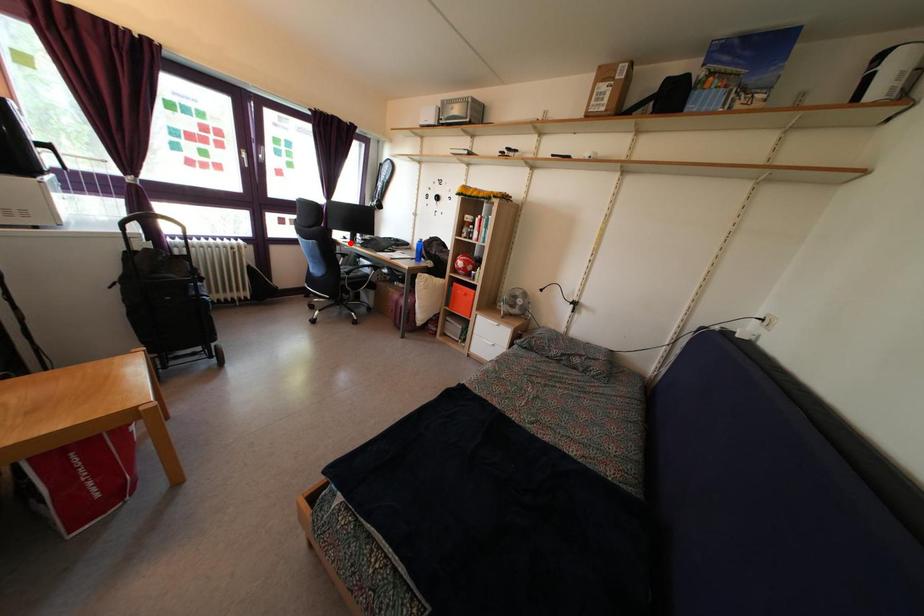
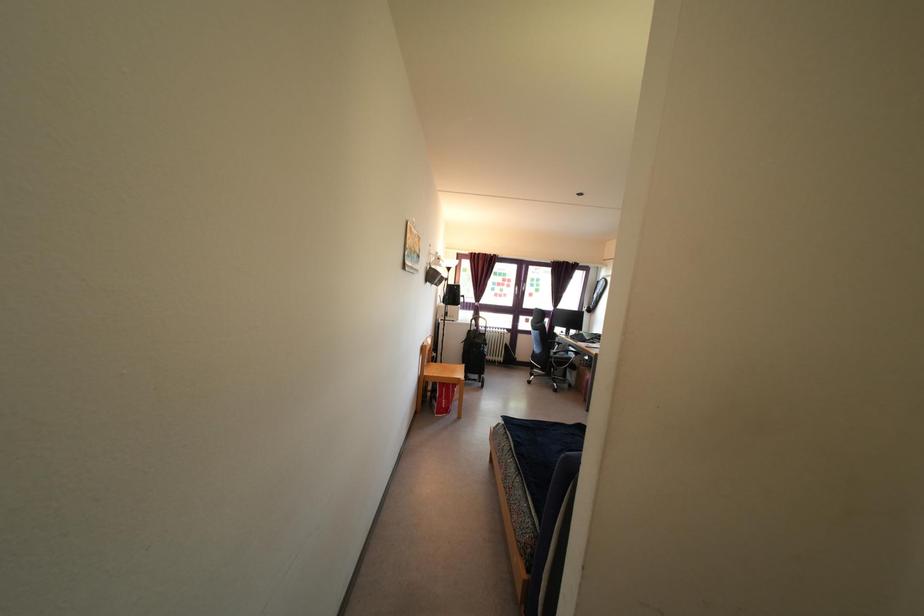
In the second image, find the point that corresponds to the highlighted location in the first image.

(566, 338)